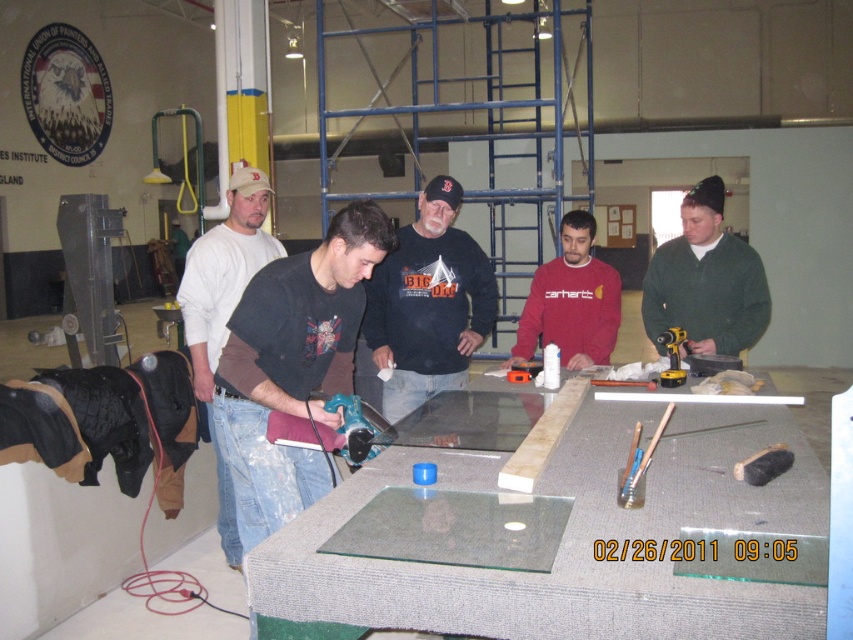
Locate an element on the screen. The width and height of the screenshot is (853, 640). black matte shirt at center is located at coordinates (292, 365).

Image resolution: width=853 pixels, height=640 pixels. What do you see at coordinates (292, 365) in the screenshot?
I see `black matte shirt at center` at bounding box center [292, 365].

In order to click on black matte shirt at center in this screenshot , I will do `click(292, 365)`.

Between clear glass table at center and blue plastic drill at center, which one has more height?

Standing taller between the two is clear glass table at center.

Is clear glass table at center smaller than blue plastic drill at center?

Actually, clear glass table at center might be larger than blue plastic drill at center.

Who is more forward, (532, 602) or (663, 337)?

Positioned in front is point (532, 602).

Find the location of `clear glass table at center`. clear glass table at center is located at coordinates (572, 540).

Does black matte shirt at center appear on the right side of red cotton shirt at center?

No, black matte shirt at center is not to the right of red cotton shirt at center.

In the scene shown: Who is more forward, (260, 298) or (608, 273)?

Point (260, 298)

Identify the location of black matte shirt at center. (292, 365).